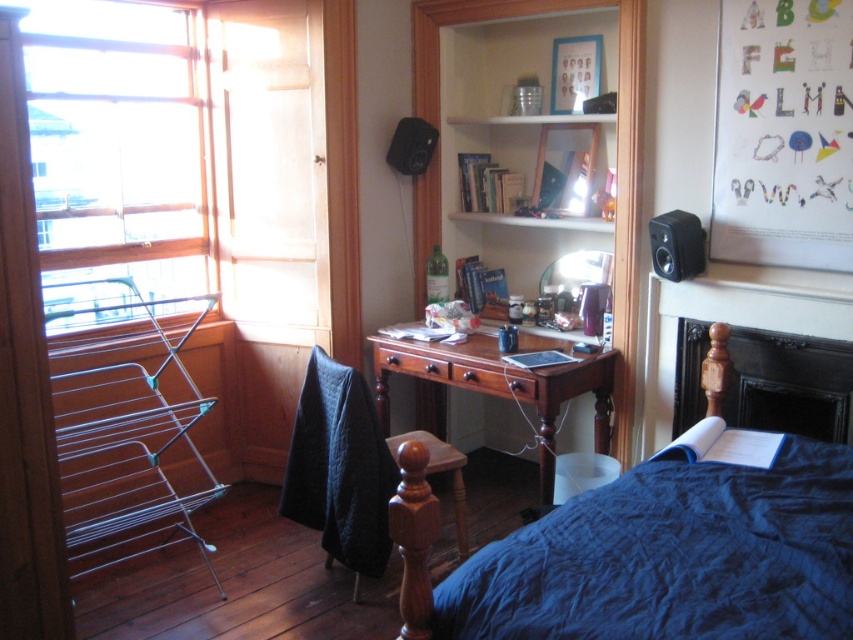
Does dark blue fabric bed at lower right lie behind black plastic speaker at upper center?

No, dark blue fabric bed at lower right is in front of black plastic speaker at upper center.

Describe the element at coordinates (654, 545) in the screenshot. I see `dark blue fabric bed at lower right` at that location.

Who is more forward, (791, 481) or (431, 154)?

Point (791, 481)

Locate an element on the screen. This screenshot has height=640, width=853. dark blue fabric bed at lower right is located at coordinates (654, 545).

Can you confirm if dark quilted fabric at lower center is positioned below black plastic speaker at upper right?

Yes, dark quilted fabric at lower center is below black plastic speaker at upper right.

Does dark quilted fabric at lower center have a greater height compared to black plastic speaker at upper right?

Indeed, dark quilted fabric at lower center has a greater height compared to black plastic speaker at upper right.

You are a GUI agent. You are given a task and a screenshot of the screen. Output one action in this format:
    pyautogui.click(x=<x>, y=<y>)
    Task: Click on the dark quilted fabric at lower center
    This screenshot has width=853, height=640.
    Given the screenshot: What is the action you would take?
    [352, 468]

Image resolution: width=853 pixels, height=640 pixels. In order to click on dark quilted fabric at lower center in this screenshot , I will do `click(352, 468)`.

Is wooden shelf at upper center further to the viewer compared to black plastic speaker at upper right?

Yes.

From the picture: Can you confirm if wooden shelf at upper center is thinner than black plastic speaker at upper right?

No.

Is point (508, 164) positioned before point (689, 232)?

No.

I want to click on wooden shelf at upper center, so click(x=538, y=168).